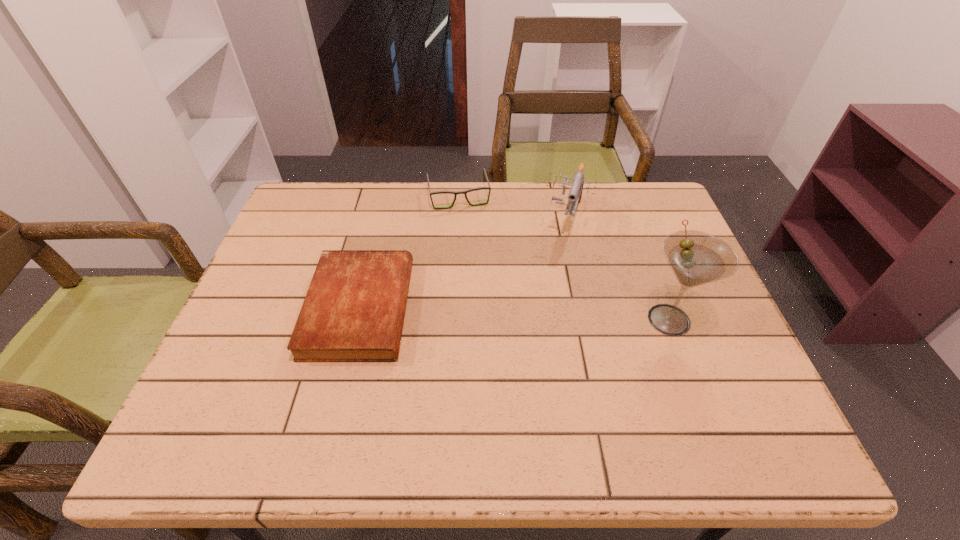
Identify the location of free region located 0.200m at the barrel end of the second tallest object. The height and width of the screenshot is (540, 960). (550, 291).

Identify the location of vacant space located at the barrel end of the second tallest object. Image resolution: width=960 pixels, height=540 pixels. (556, 272).

The height and width of the screenshot is (540, 960). Identify the location of vacant point located 0.250m at the barrel end of the second tallest object. (545, 305).

You are a GUI agent. You are given a task and a screenshot of the screen. Output one action in this format:
    pyautogui.click(x=<x>, y=<y>)
    Task: Click on the free spot located on the lens of the second shortest object
    The image size is (960, 540).
    Given the screenshot: What is the action you would take?
    pyautogui.click(x=481, y=288)

The image size is (960, 540). Find the location of `free spot located 0.140m on the lens of the second shortest object`. free spot located 0.140m on the lens of the second shortest object is located at coordinates (470, 241).

Find the location of a particular element. vacant region located on the lens of the second shortest object is located at coordinates (469, 237).

Identify the location of gun located at the far edge. (575, 194).

Locate an element on the screen. spectacles at the far edge is located at coordinates (465, 192).

Locate an element on the screen. Image resolution: width=960 pixels, height=540 pixels. object located in the right edge section of the desktop is located at coordinates (696, 258).

Where is `free space at the far edge of the desktop`? The image size is (960, 540). free space at the far edge of the desktop is located at coordinates (555, 220).